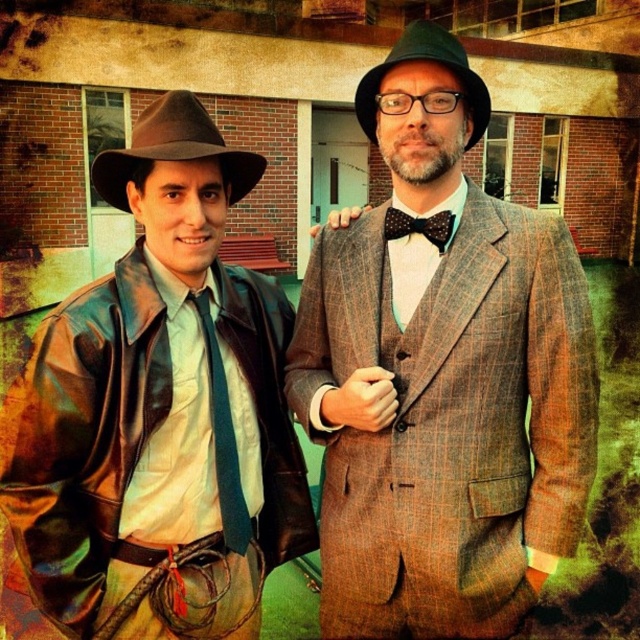
Between green felt fedora at upper center and black dotted fabric bow tie at center, which one is positioned higher?

green felt fedora at upper center

Who is taller, green felt fedora at upper center or black dotted fabric bow tie at center?

green felt fedora at upper center is taller.

Where is `green felt fedora at upper center`? The height and width of the screenshot is (640, 640). green felt fedora at upper center is located at coordinates (426, 60).

Does plaid wool suit at center have a smaller size compared to green felt fedora at upper center?

No.

Does plaid wool suit at center have a lesser width compared to green felt fedora at upper center?

Incorrect, plaid wool suit at center's width is not less than green felt fedora at upper center's.

You are a GUI agent. You are given a task and a screenshot of the screen. Output one action in this format:
    pyautogui.click(x=<x>, y=<y>)
    Task: Click on the plaid wool suit at center
    The image size is (640, 640).
    Given the screenshot: What is the action you would take?
    pyautogui.click(x=442, y=376)

Locate an element on the screen. plaid wool suit at center is located at coordinates (442, 376).

In the scene shown: Is leather jacket at left above green felt fedora at upper center?

No, leather jacket at left is not above green felt fedora at upper center.

Is leather jacket at left wider than green felt fedora at upper center?

Yes.

Who is more distant from viewer, (x=266, y=339) or (x=410, y=52)?

Point (x=266, y=339)

You are a GUI agent. You are given a task and a screenshot of the screen. Output one action in this format:
    pyautogui.click(x=<x>, y=<y>)
    Task: Click on the leather jacket at left
    This screenshot has width=640, height=640.
    Given the screenshot: What is the action you would take?
    pyautogui.click(x=160, y=408)